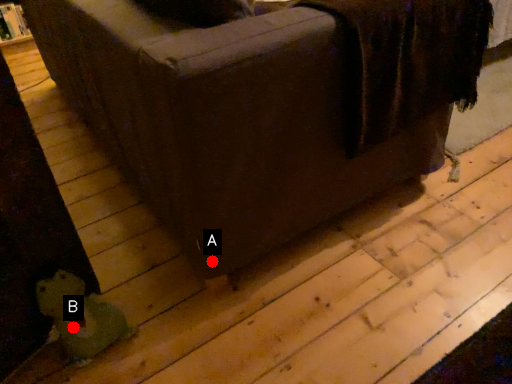
Question: Two points are circled on the image, labeled by A and B beside each circle. Which point appears closest to the camera in this image?

Choices:
 (A) A is closer
 (B) B is closer

Answer: (B)